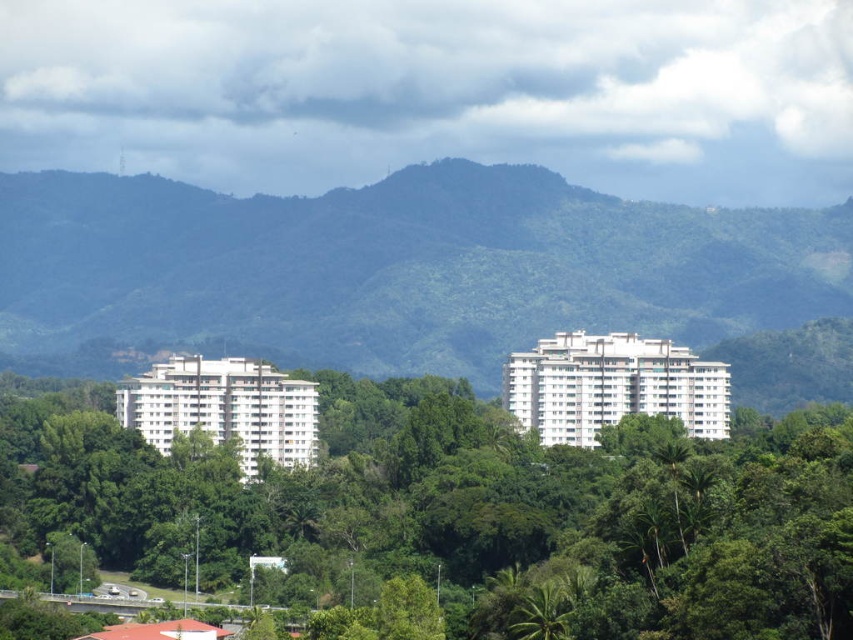
Question: Which point is farther to the camera?

Choices:
 (A) (186, 301)
 (B) (271, 586)

Answer: (B)

Question: Is green leafy tree at center to the left of green leafy mountain at center from the viewer's perspective?

Choices:
 (A) yes
 (B) no

Answer: (A)

Question: Which of the following is the closest to the observer?

Choices:
 (A) green leafy tree at center
 (B) green leafy mountain at center

Answer: (A)

Question: Can you confirm if green leafy tree at center is smaller than green leafy mountain at center?

Choices:
 (A) no
 (B) yes

Answer: (A)

Question: Which of the following is the farthest from the observer?

Choices:
 (A) green leafy mountain at center
 (B) green leafy tree at center

Answer: (A)

Question: From the image, what is the correct spatial relationship of green leafy tree at center in relation to green leafy mountain at center?

Choices:
 (A) right
 (B) left

Answer: (B)